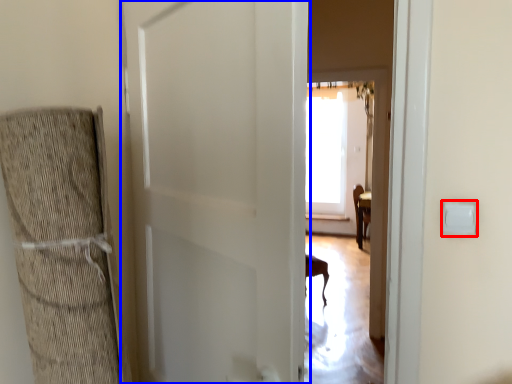
Question: Among these objects, which one is farthest to the camera, light switch (highlighted by a red box) or door (highlighted by a blue box)?

Choices:
 (A) light switch
 (B) door

Answer: (A)